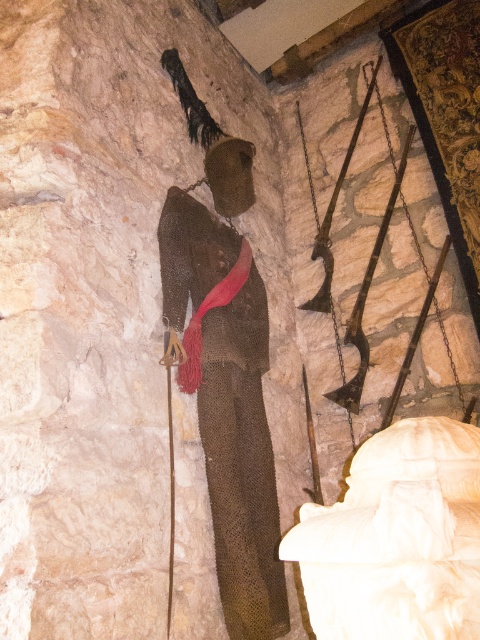
You are a museum security guard checking the layout of the medieval exhibit. You need to ensure that the gold chainmail suit at center and wooden ski pole at center are spaced appropriately. According to the exhibit guidelines, the minimum distance between any two items should be 1.2 meters. Can you confirm if the current spacing meets this requirement?

The gold chainmail suit at center is wider than the wooden ski pole at center, but the Objects Description only provides information about their widths, not the distance between them. Therefore, I cannot confirm if the spacing meets the 1.2 meters requirement based on the given information.

You are standing at the camera position and want to reach the point marked as point (216, 202). Can you walk directly to it without moving any objects?

The point (216, 202) is 6.72 feet away from the camera, so yes, you can walk directly to it without moving any objects as there is enough space.

You are a museum visitor standing in front of the medieval display. You notice the gold chainmail suit at center and want to take a photo. The museum requires visitors to stay at least 1 meter away from all exhibits. If you are currently standing at point 0.634, 0.475, can you safely take the photo without violating the distance rule?

The gold chainmail suit at center is located at point (x=228, y=404). Since you are standing at the same coordinates, you are too close to the exhibit. Move back to maintain the required 1 meter distance before taking the photo.